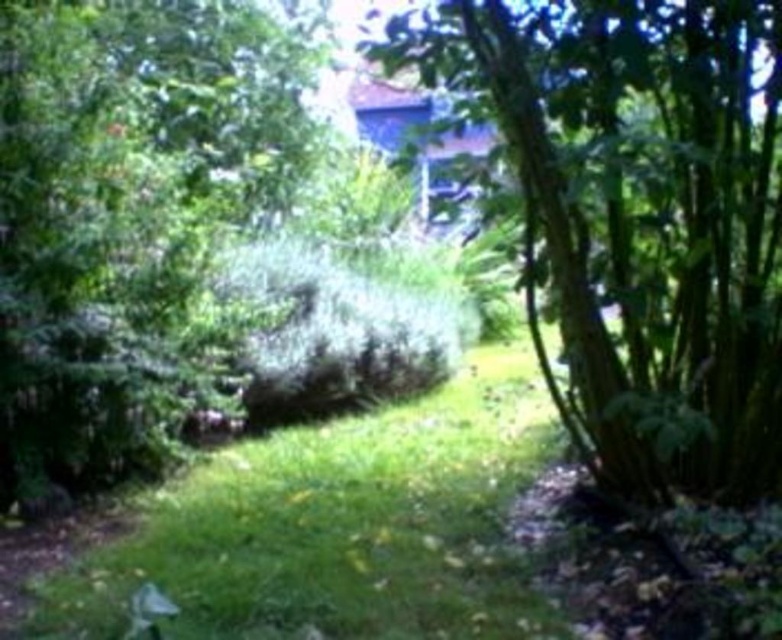
Is green leafy tree at center thinner than green grass at center?

Indeed, green leafy tree at center has a lesser width compared to green grass at center.

Is green leafy tree at center bigger than green grass at center?

Yes, green leafy tree at center is bigger than green grass at center.

Image resolution: width=782 pixels, height=640 pixels. I want to click on green leafy tree at center, so click(641, 220).

What are the coordinates of `green leafy tree at center` in the screenshot? It's located at (641, 220).